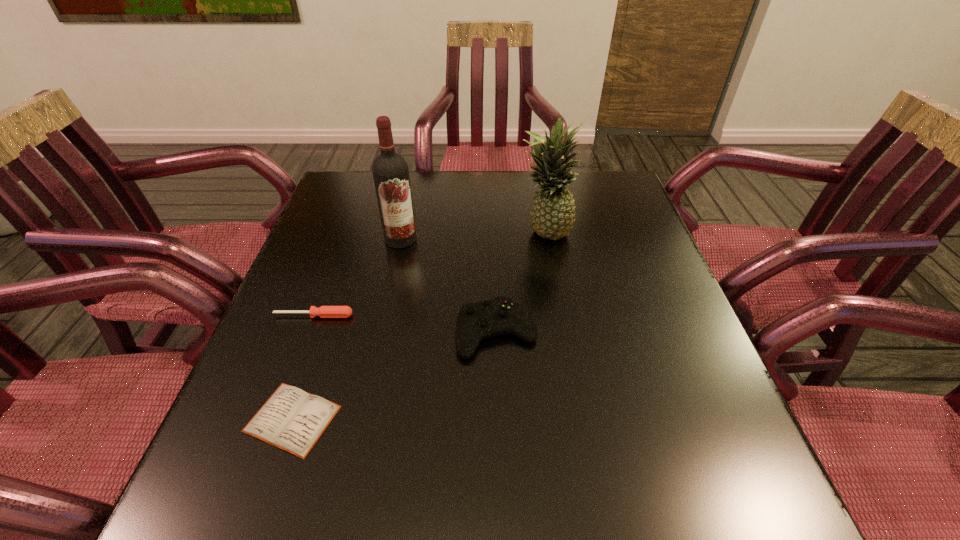
The height and width of the screenshot is (540, 960). What are the coordinates of `the third object from left to right` in the screenshot? It's located at (390, 171).

Where is `pineapple`? pineapple is located at coordinates (552, 216).

Find the location of a particular element. The image size is (960, 540). the third tallest object is located at coordinates (476, 321).

This screenshot has height=540, width=960. Identify the location of screwdriver. (324, 311).

Identify the location of the nearest object. The width and height of the screenshot is (960, 540). (293, 420).

Locate an element on the screen. The height and width of the screenshot is (540, 960). the shortest object is located at coordinates (293, 420).

Where is `free location located on the label of the wine bottle`? free location located on the label of the wine bottle is located at coordinates (394, 273).

You are a GUI agent. You are given a task and a screenshot of the screen. Output one action in this format:
    pyautogui.click(x=<x>, y=<y>)
    Task: Click on the free point located 0.100m on the right of the pineapple
    This screenshot has width=960, height=540.
    Given the screenshot: What is the action you would take?
    pyautogui.click(x=610, y=234)

The height and width of the screenshot is (540, 960). Find the location of `free region located on the left of the third tallest object`. free region located on the left of the third tallest object is located at coordinates (300, 332).

Where is `free space located on the front of the fourth tallest object`? free space located on the front of the fourth tallest object is located at coordinates (251, 486).